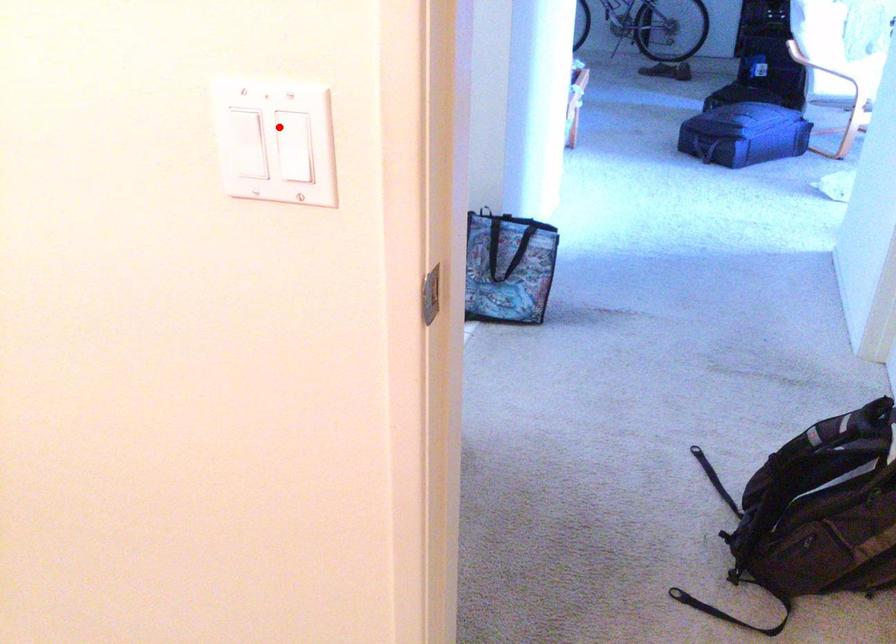
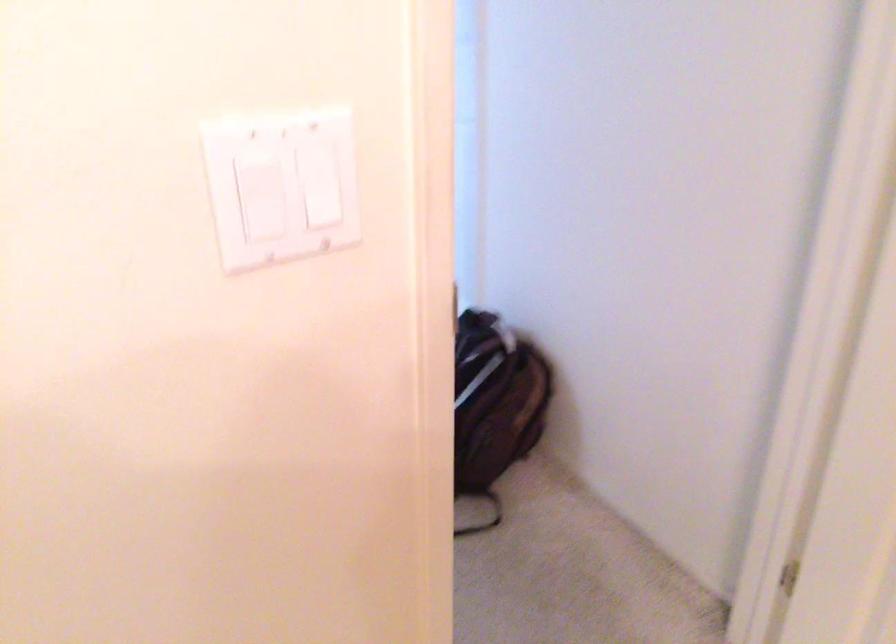
Question: I am providing you with two images of the same scene from different viewpoints. Given a red point in image1, look at the same physical point in image2. Is it:

Choices:
 (A) Closer to the viewpoint
 (B) Farther from the viewpoint

Answer: (A)